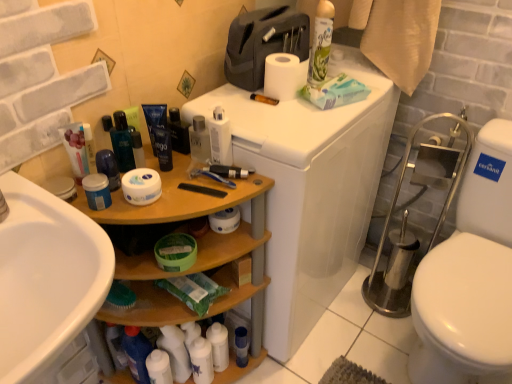
This screenshot has width=512, height=384. In order to click on free spot above wooden shelf at left (from a real-world perspective) in this screenshot , I will do `click(162, 192)`.